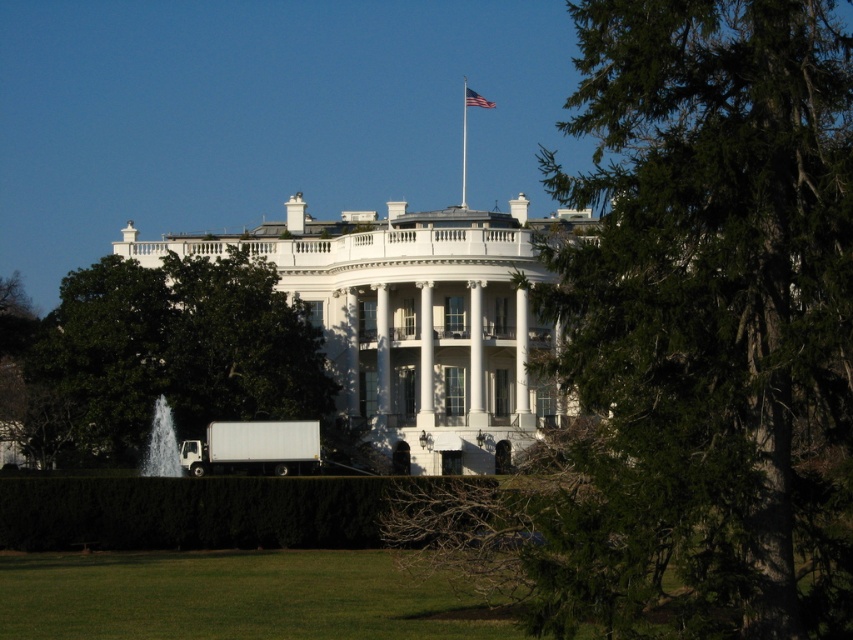
You are a photographer planning to take a picture of the White House. You notice the green leafy tree at upper right and the american flag at upper center in the frame. Which object is positioned to the right side of the other?

The green leafy tree at upper right is to the right of the american flag at upper center.

You are standing in front of the White House and want to take a photo of the white glossy column at center. If you are exactly 119.03 meters away from it, will you be able to capture the entire column in your camera frame?

The white glossy column at center is exactly 119.03 meters away from the viewer. Whether you can capture the entire column depends on your camera lens. A standard lens might require moving closer, while a wide angle could include it from that distance.

Looking at this image, you are a photographer planning to take a picture of the White House. You notice the green leafy hedge at lower center and the white glossy column at center. Which object would you need to position your camera closer to in order to capture both in the same frame?

The green leafy hedge at lower center is wider than the white glossy column at center, so you should position your camera closer to the green leafy hedge at lower center to ensure both fit within the frame.